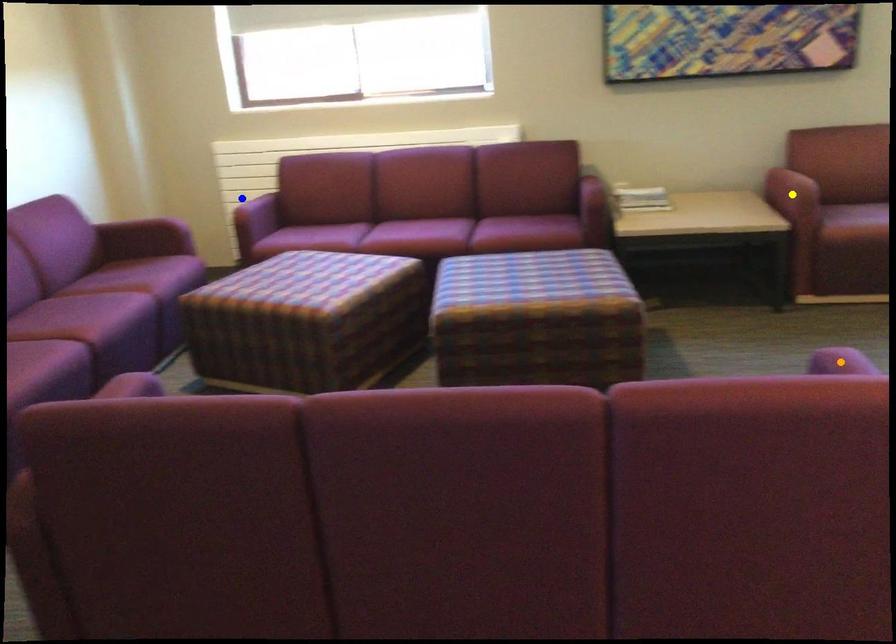
Order these from nearest to farthest:
- yellow point
- orange point
- blue point

blue point, yellow point, orange point